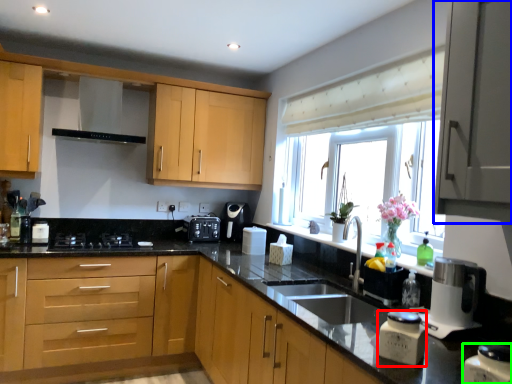
Question: Which is nearer to the kitchen appliance (highlighted by a red box)? cabinetry (highlighted by a blue box) or kitchen appliance (highlighted by a green box).

Choices:
 (A) cabinetry
 (B) kitchen appliance

Answer: (B)